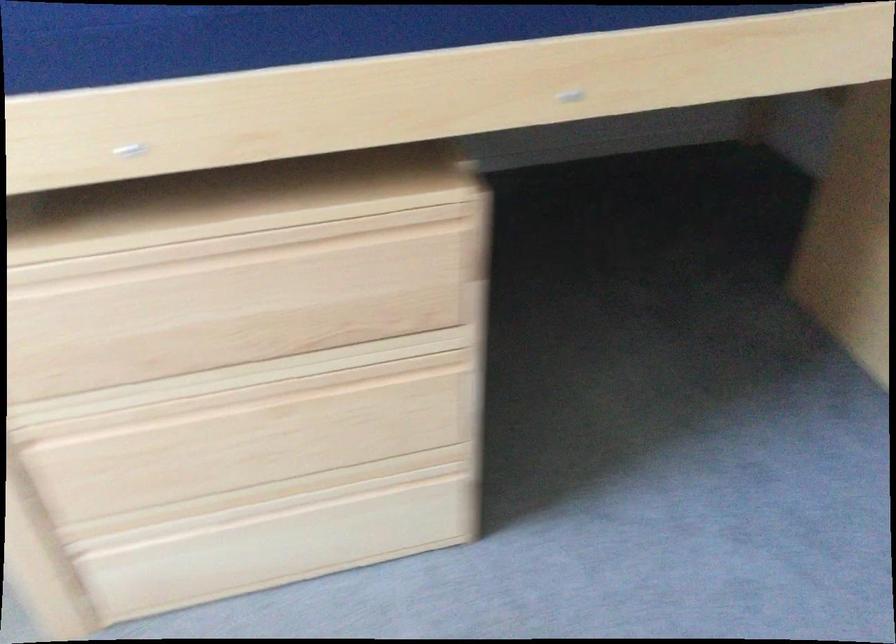
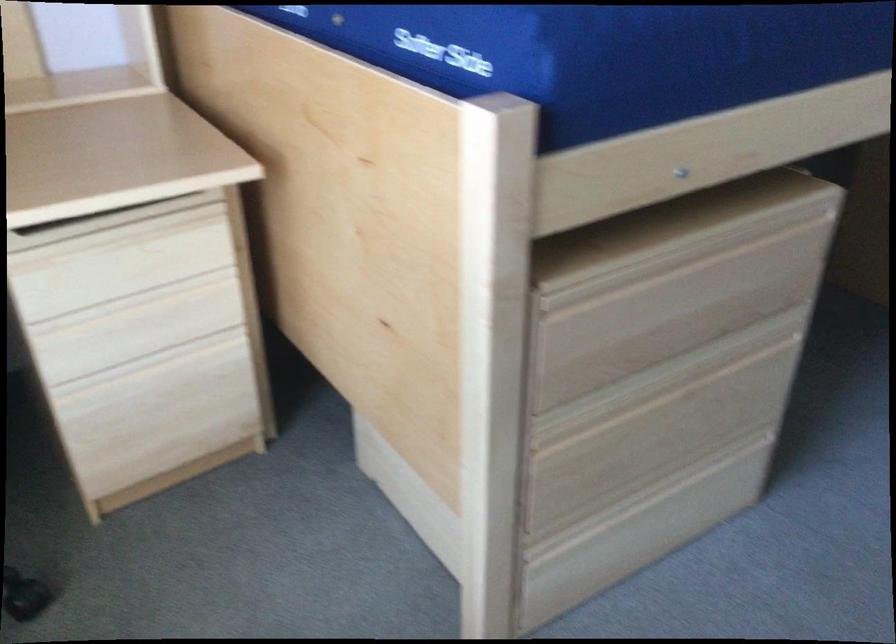
Where in the second image is the point corresponding to (x=186, y=228) from the first image?

(668, 240)